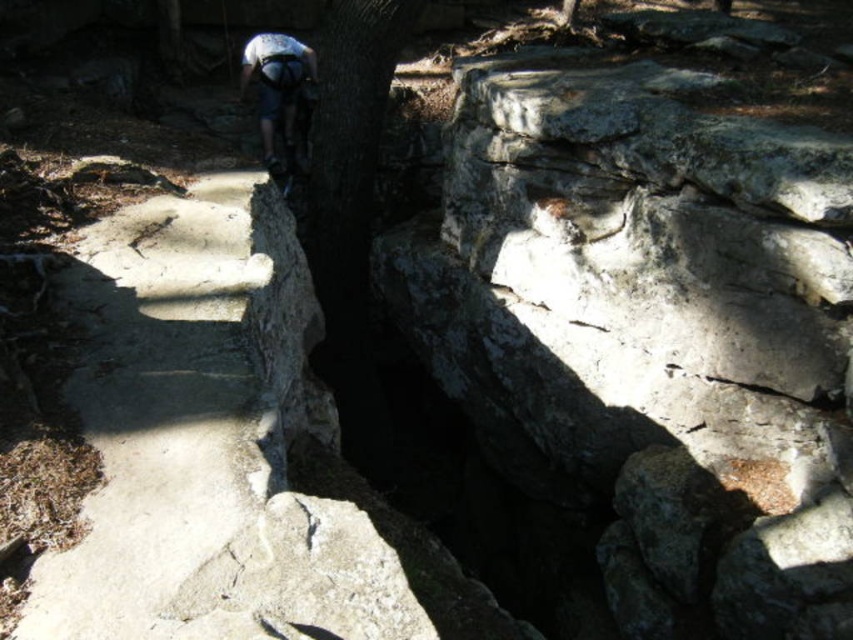
You are a hiker who wants to descend the steep rocky path. You notice a point marked at coordinates (173, 403). What is located at this point that might help you navigate safely?

The point at coordinates (173, 403) marks white concrete steps at center, which can provide a safer path for descending the steep rocky terrain.

You are a hiker who needs to climb up the white concrete steps at center. You have a white matte helmet at upper center. Can you safely place your helmet on the steps without it rolling off?

The white concrete steps at center has a greater height compared to white matte helmet at upper center, so the helmet can be placed on the steps without rolling off as the steps provide a stable surface.

You are a hiker trying to navigate the rocky terrain. You notice the white concrete steps at center and the white matte helmet at upper center. Which object is wider?

The white concrete steps at center is wider than the white matte helmet at upper center.